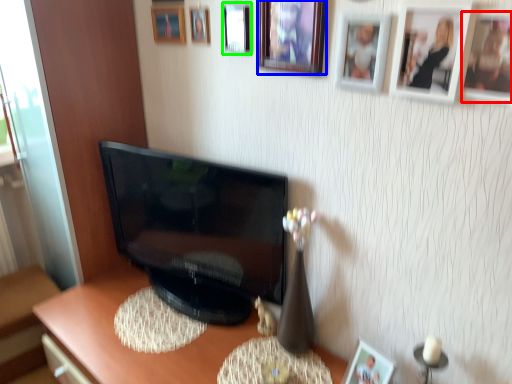
Question: Which object is the farthest from picture frame (highlighted by a red box)? Choose among these: picture frame (highlighted by a blue box) or picture frame (highlighted by a green box).

Choices:
 (A) picture frame
 (B) picture frame

Answer: (B)